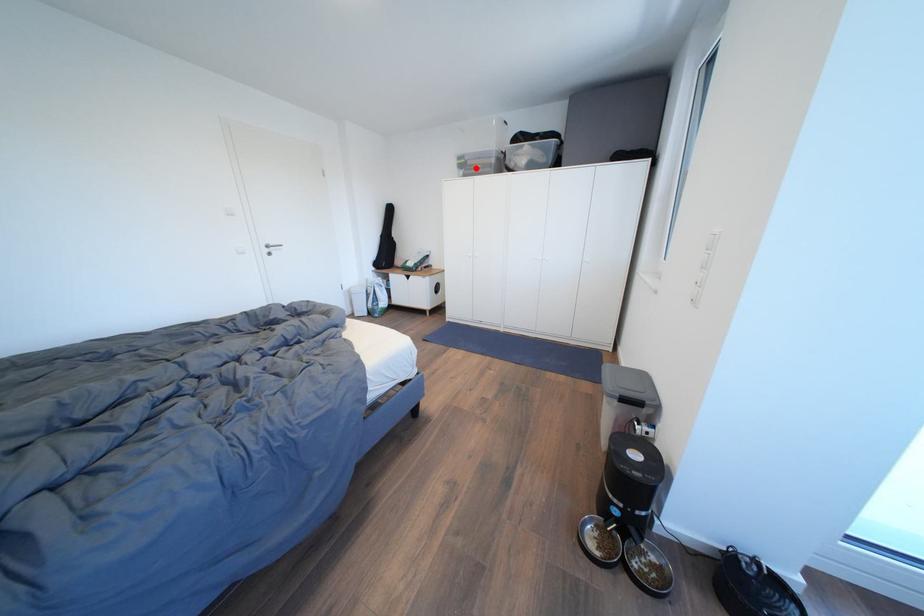
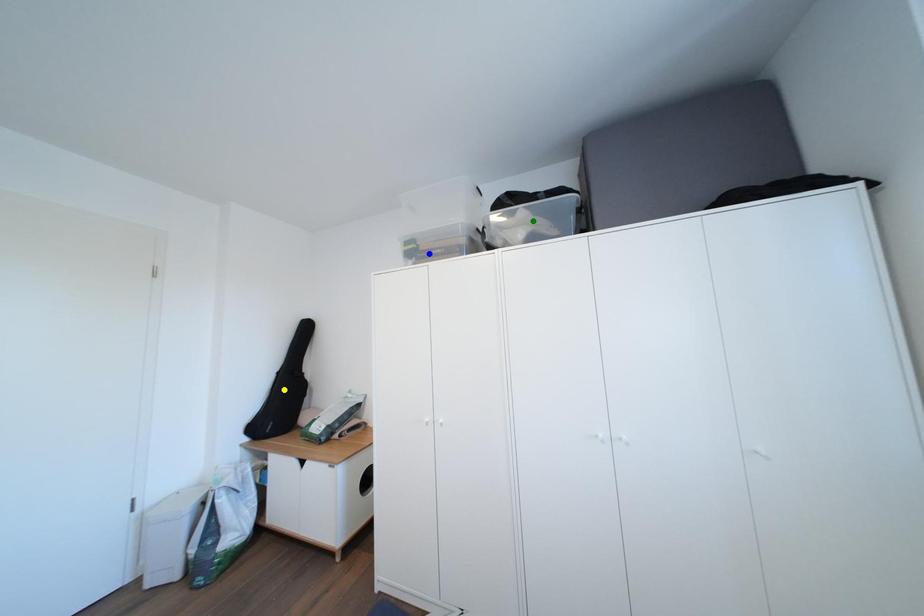
Question: I am providing you with two images of the same scene from different viewpoints. A red point is marked on the first image. You are given multiple points on the second image. Can you choose the point in image 2 that corresponds to the point in image 1?

Choices:
 (A) blue point
 (B) green point
 (C) yellow point

Answer: (A)